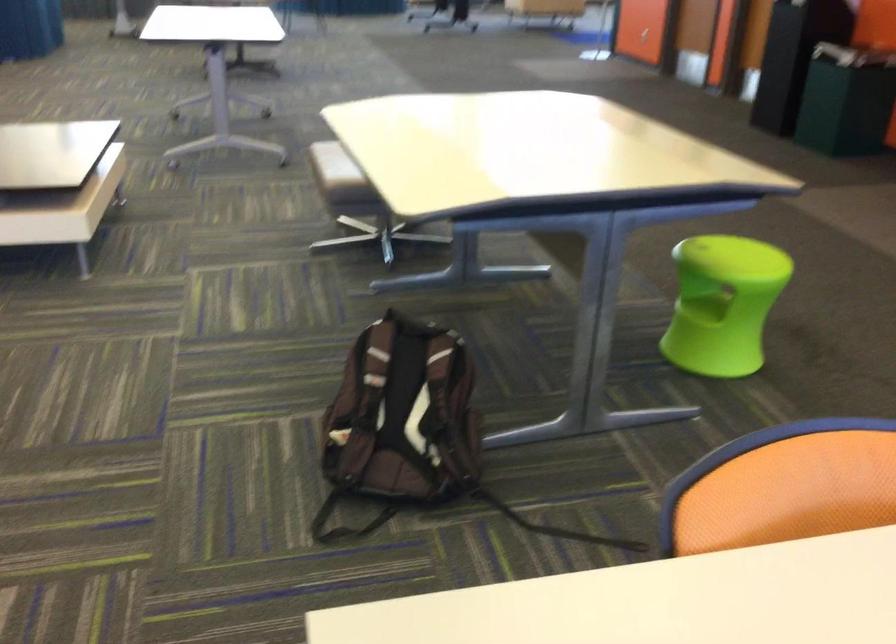
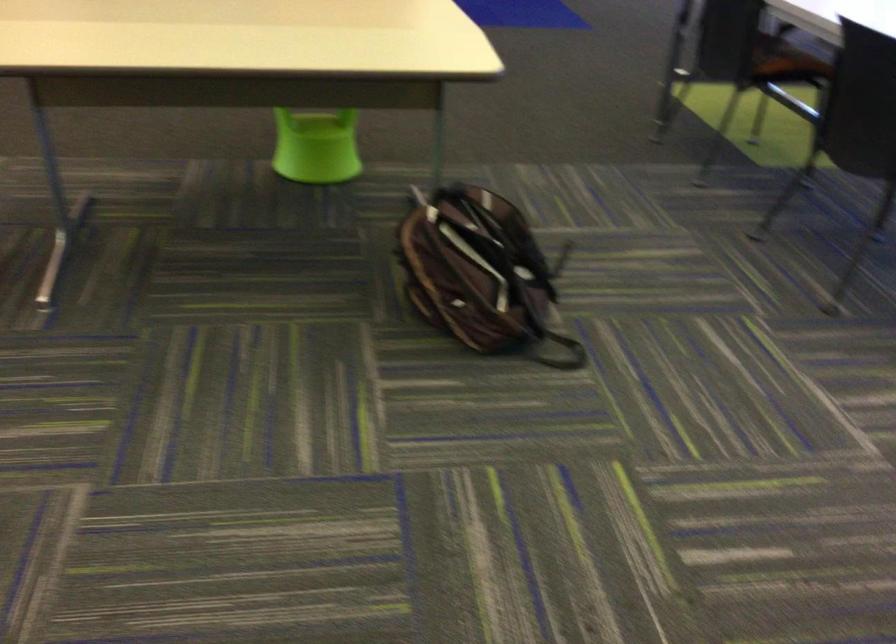
The point at (374, 166) is marked in the first image. Where is the corresponding point in the second image?

(322, 67)